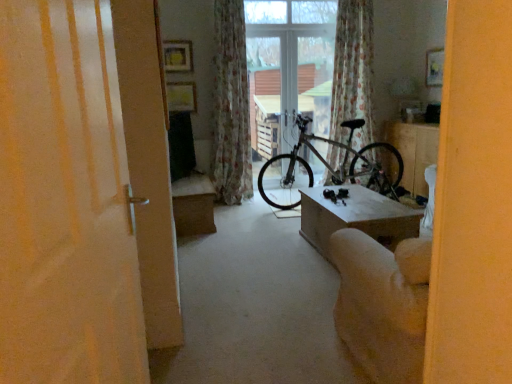
Describe the element at coordinates (231, 105) in the screenshot. I see `floral fabric curtain at center, which ranks as the first curtain in left-to-right order` at that location.

Where is `floral fabric curtain at upper center, the first curtain viewed from the right`? This screenshot has height=384, width=512. floral fabric curtain at upper center, the first curtain viewed from the right is located at coordinates (352, 70).

Where is `white glossy table at center, positioned as the 1th table in right-to-left order`? This screenshot has height=384, width=512. white glossy table at center, positioned as the 1th table in right-to-left order is located at coordinates (413, 151).

What is the approximate height of light brown wooden table at center, placed as the 2th table when sorted from back to front?

17.53 inches.

What do you see at coordinates (356, 217) in the screenshot?
I see `light brown wooden table at center, which is the 1th table in front-to-back order` at bounding box center [356, 217].

Locate an element on the screen. This screenshot has width=512, height=384. matte white door at left is located at coordinates [65, 202].

From the image's perspective, is beige fabric armchair at lower right on top of matte white door at left?

No, from the image's perspective, beige fabric armchair at lower right is not over matte white door at left.

How different are the orientations of beige fabric armchair at lower right and matte white door at left in degrees?

There is a 99.3-degree angle between the facing directions of beige fabric armchair at lower right and matte white door at left.

Does beige fabric armchair at lower right have a greater width compared to matte white door at left?

Indeed, beige fabric armchair at lower right has a greater width compared to matte white door at left.

Based on the photo, is matte white door at left at the back of beige fabric armchair at lower right?

beige fabric armchair at lower right is not turned away from matte white door at left.

From a real-world perspective, relative to transparent glass window at center, is beige fabric armchair at lower right vertically above or below?

beige fabric armchair at lower right is below transparent glass window at center.

From the image's perspective, does beige fabric armchair at lower right appear higher than transparent glass window at center?

No, from the image's perspective, beige fabric armchair at lower right is not over transparent glass window at center.

Is matte white door at left spatially inside white glossy table at center, the 1th table viewed from the back, or outside of it?

matte white door at left is located beyond the bounds of white glossy table at center, the 1th table viewed from the back.

Is point (76, 195) behind point (428, 145)?

No, (76, 195) is in front of (428, 145).

Considering the relative sizes of matte white door at left and white glossy table at center, the 1th table viewed from the back, in the image provided, is matte white door at left smaller than white glossy table at center, the 1th table viewed from the back,?

Yes, matte white door at left is smaller than white glossy table at center, the 1th table viewed from the back.

Are matte white door at left and white glossy table at center, positioned as the 1th table in right-to-left order, making contact?

No.

Which of these two, floral fabric curtain at center, which ranks as the first curtain in left-to-right order, or white glossy table at center, the second table in the front-to-back sequence, is bigger?

Bigger between the two is floral fabric curtain at center, which ranks as the first curtain in left-to-right order.

Is floral fabric curtain at center, which ranks as the first curtain in left-to-right order, turned away from white glossy table at center, positioned as the 1th table in right-to-left order?

No, white glossy table at center, positioned as the 1th table in right-to-left order, is not at the back of floral fabric curtain at center, which ranks as the first curtain in left-to-right order.

From the picture: Is floral fabric curtain at center, which ranks as the first curtain in left-to-right order, next to white glossy table at center, the 1th table viewed from the back, and touching it?

No, floral fabric curtain at center, which ranks as the first curtain in left-to-right order, is not making contact with white glossy table at center, the 1th table viewed from the back.

From a real-world perspective, is floral fabric curtain at center, which ranks as the first curtain in left-to-right order, on top of white glossy table at center, positioned as the 1th table in right-to-left order?

Yes, from a real-world perspective, floral fabric curtain at center, which ranks as the first curtain in left-to-right order, is above white glossy table at center, positioned as the 1th table in right-to-left order.

Does matte white door at left contain silver metallic bicycle at center?

No, silver metallic bicycle at center is not inside matte white door at left.

From the image's perspective, which is below, matte white door at left or silver metallic bicycle at center?

matte white door at left.

Does point (73, 82) lie in front of point (288, 168)?

Yes, it is.

Can you confirm if matte white door at left is smaller than silver metallic bicycle at center?

Correct, matte white door at left occupies less space than silver metallic bicycle at center.

Could you tell me if transparent glass window at center is turned towards silver metallic bicycle at center?

Yes, transparent glass window at center is turned towards silver metallic bicycle at center.

From the image's perspective, is transparent glass window at center above or below silver metallic bicycle at center?

From the image's perspective, transparent glass window at center appears above silver metallic bicycle at center.

Is transparent glass window at center next to silver metallic bicycle at center?

transparent glass window at center and silver metallic bicycle at center are clearly separated.

Measure the distance between transparent glass window at center and silver metallic bicycle at center.

29.96 inches.

Which is closer to the camera, (x=280, y=79) or (x=351, y=51)?

Point (x=280, y=79) appears to be farther away from the viewer than point (x=351, y=51).

Is transparent glass window at center to the left or to the right of floral fabric curtain at upper center, the first curtain viewed from the right, in the image?

From the image, it's evident that transparent glass window at center is to the left of floral fabric curtain at upper center, the first curtain viewed from the right.

Is transparent glass window at center next to floral fabric curtain at upper center, the first curtain viewed from the right, and touching it?

transparent glass window at center and floral fabric curtain at upper center, the first curtain viewed from the right, are not in contact.

Is transparent glass window at center not inside floral fabric curtain at upper center, the first curtain viewed from the right?

Absolutely, transparent glass window at center is external to floral fabric curtain at upper center, the first curtain viewed from the right.

Identify the location of door positioned vertically above the beige fabric armchair at lower right (from a real-world perspective). (65, 202).

The image size is (512, 384). What are the coordinates of `armchair on the right side of transparent glass window at center` in the screenshot? It's located at (385, 299).

Looking at the image, which one is located closer to matte white door at left, transparent glass window at center or beige fabric armchair at lower right?

beige fabric armchair at lower right is closer to matte white door at left.

Which object lies further to the anchor point floral fabric curtain at upper center, positioned as the 2th curtain in left-to-right order, matte white door at left or floral fabric curtain at center, positioned as the 2th curtain in right-to-left order?

The object further to floral fabric curtain at upper center, positioned as the 2th curtain in left-to-right order, is matte white door at left.

Looking at the image, which one is located further to transparent glass window at center, floral fabric curtain at center, which ranks as the first curtain in left-to-right order, or floral fabric curtain at upper center, the first curtain viewed from the right?

floral fabric curtain at center, which ranks as the first curtain in left-to-right order, is positioned further to the anchor transparent glass window at center.

When comparing their distances from transparent glass window at center, does matte white door at left or floral fabric curtain at center, positioned as the 2th curtain in right-to-left order, seem further?

matte white door at left.

Based on their spatial positions, is silver metallic bicycle at center or floral fabric curtain at upper center, positioned as the 2th curtain in left-to-right order, further from light brown wooden table at center, which is the 1th table in front-to-back order?

floral fabric curtain at upper center, positioned as the 2th curtain in left-to-right order.

Estimate the real-world distances between objects in this image. Which object is closer to silver metallic bicycle at center, light brown wooden table at center, which is the 1th table in front-to-back order, or white glossy table at center, positioned as the 1th table in right-to-left order?

The object closer to silver metallic bicycle at center is white glossy table at center, positioned as the 1th table in right-to-left order.

Which object lies nearer to the anchor point beige fabric armchair at lower right, silver metallic bicycle at center or matte white door at left?

matte white door at left is closer to beige fabric armchair at lower right.

When comparing their distances from silver metallic bicycle at center, does beige fabric armchair at lower right or floral fabric curtain at upper center, positioned as the 2th curtain in left-to-right order, seem closer?

floral fabric curtain at upper center, positioned as the 2th curtain in left-to-right order, is positioned closer to the anchor silver metallic bicycle at center.

The width and height of the screenshot is (512, 384). In order to click on window between floral fabric curtain at center, which ranks as the first curtain in left-to-right order, and white glossy table at center, positioned as the 1th table in right-to-left order, from left to right in this screenshot , I will do `click(288, 65)`.

You are a GUI agent. You are given a task and a screenshot of the screen. Output one action in this format:
    pyautogui.click(x=<x>, y=<y>)
    Task: Click on the bicycle situated between transparent glass window at center and white glossy table at center, positioned as the 1th table in right-to-left order, from left to right
    Image resolution: width=512 pixels, height=384 pixels.
    Given the screenshot: What is the action you would take?
    pyautogui.click(x=339, y=167)

Identify the location of curtain located between silver metallic bicycle at center and white glossy table at center, the second table in the left-to-right sequence, in the left-right direction. (352, 70).

What are the coordinates of `table between matte white door at left and silver metallic bicycle at center in the front-back direction` in the screenshot? It's located at (356, 217).